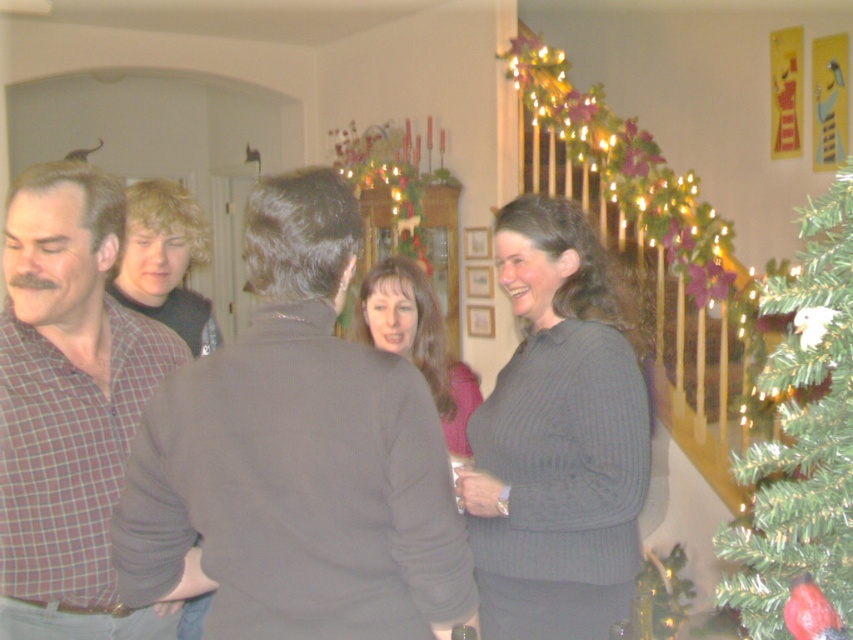
Question: Does gray ribbed sweater at center have a smaller size compared to gray sweater at center?

Choices:
 (A) yes
 (B) no

Answer: (B)

Question: Which of the following is the farthest from the observer?

Choices:
 (A) (761, 513)
 (B) (6, 518)

Answer: (A)

Question: Can you confirm if plaid shirt at left is positioned to the left of gray sweater at center?

Choices:
 (A) yes
 (B) no

Answer: (A)

Question: Which object is closer to the camera taking this photo?

Choices:
 (A) green textured christmas tree at right
 (B) plaid shirt at left
 (C) gray ribbed sweater at center
 (D) gray sweater at center

Answer: (A)

Question: Can you confirm if dark gray sweater at center is positioned below plaid shirt at left?

Choices:
 (A) yes
 (B) no

Answer: (A)

Question: Estimate the real-world distances between objects in this image. Which object is closer to the gray sweater at center?

Choices:
 (A) plaid shirt at left
 (B) green textured christmas tree at right
 (C) dark gray sweater at center

Answer: (A)